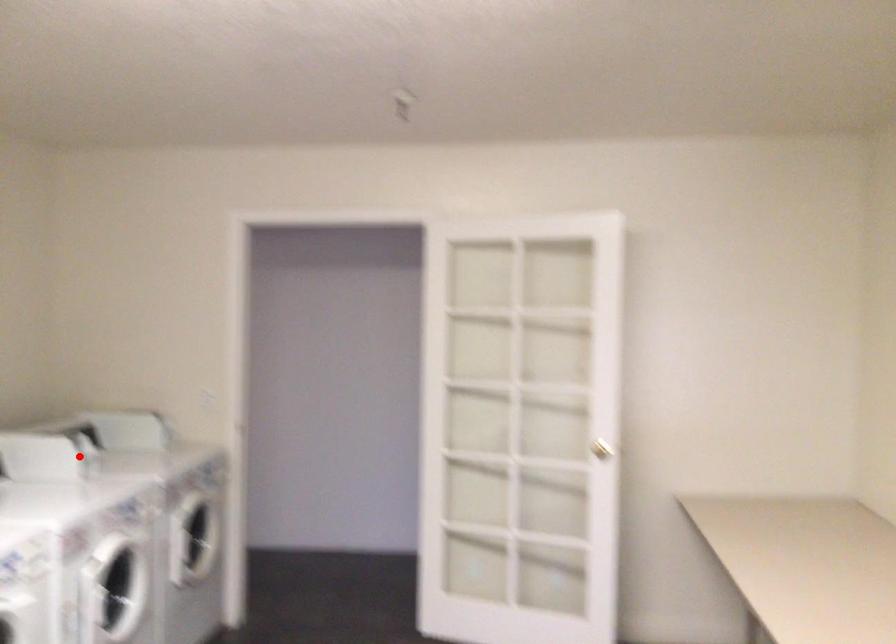
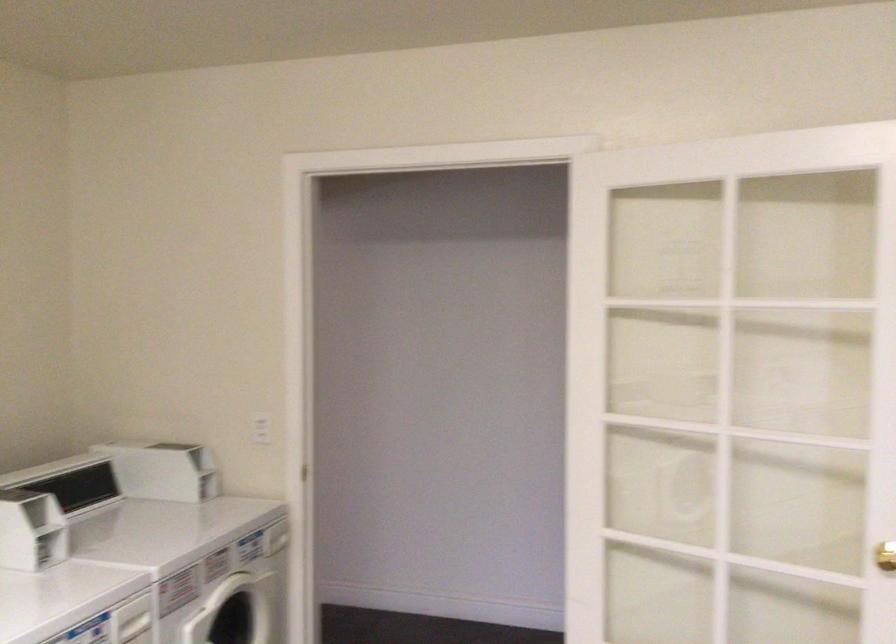
Question: I am providing you with two images of the same scene from different viewpoints. Given a red point in image1, look at the same physical point in image2. Is it:

Choices:
 (A) Closer to the viewpoint
 (B) Farther from the viewpoint

Answer: (A)